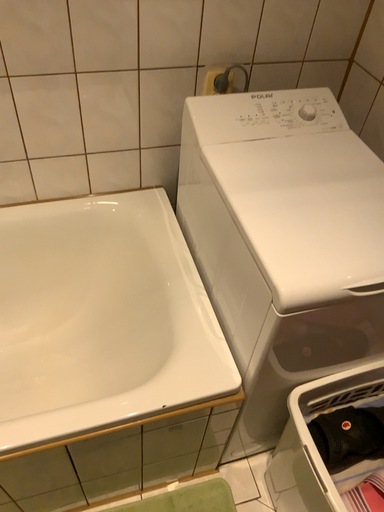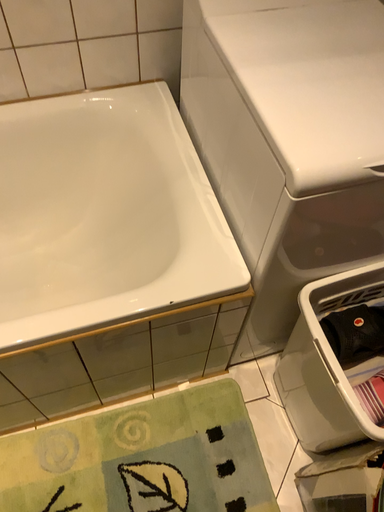
Question: How did the camera likely rotate when shooting the video?

Choices:
 (A) rotated upward
 (B) rotated downward

Answer: (B)